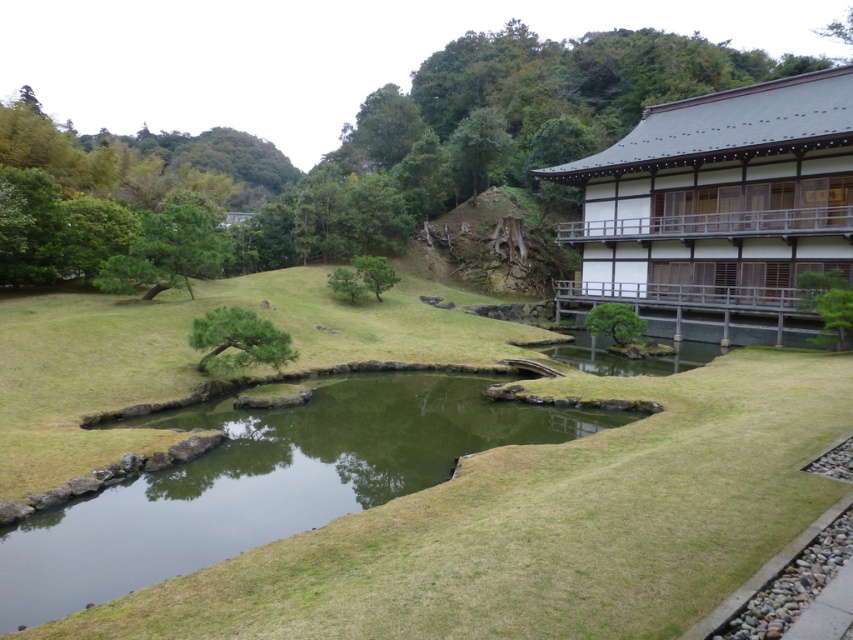
Question: Considering the relative positions of green leafy tree at center and green textured tree at center in the image provided, where is green leafy tree at center located with respect to green textured tree at center?

Choices:
 (A) above
 (B) below

Answer: (A)

Question: Estimate the real-world distances between objects in this image. Which object is farther from the green leafy tree at right?

Choices:
 (A) green grassy water at center
 (B) green leafy tree at left
 (C) green matte bonsai tree at center

Answer: (B)

Question: Can you confirm if green leafy tree at left is thinner than green matte tree at center?

Choices:
 (A) yes
 (B) no

Answer: (B)

Question: Among these points, which one is nearest to the camera?

Choices:
 (A) (302, 492)
 (B) (608, 321)
 (C) (364, 275)

Answer: (A)

Question: Which object appears closest to the camera in this image?

Choices:
 (A) green leafy tree at right
 (B) green grassy water at center
 (C) green textured tree at center

Answer: (B)

Question: Is green matte tree at center thinner than green leafy tree at right?

Choices:
 (A) yes
 (B) no

Answer: (A)